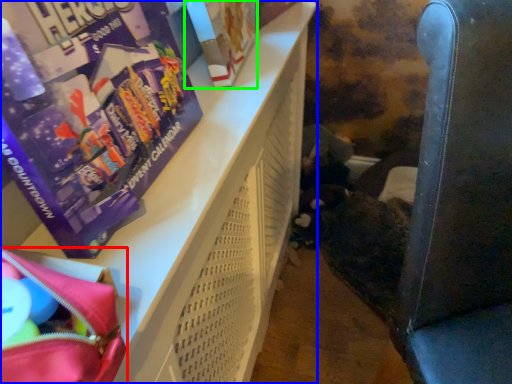
Question: Estimate the real-world distances between objects in this image. Which object is farther from bag (highlighted by a red box), furniture (highlighted by a blue box) or paperback book (highlighted by a green box)?

Choices:
 (A) furniture
 (B) paperback book

Answer: (B)